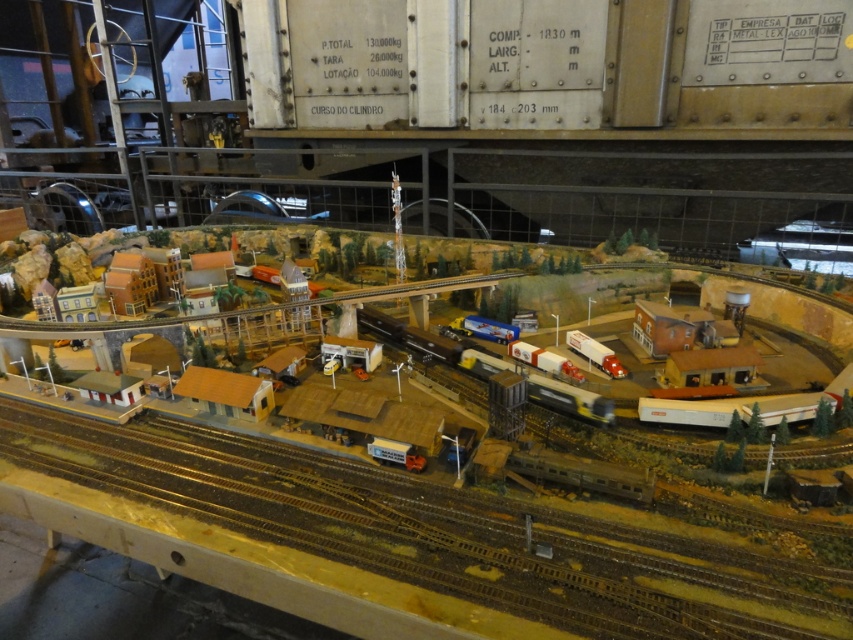
What are the coordinates of the brown wooden train track at center?

The brown wooden train track at center is located at coordinates point [426,531].

What are the coordinates of the metallic silver train at center in the image?

The coordinates of the metallic silver train at center are at point (434, 344).